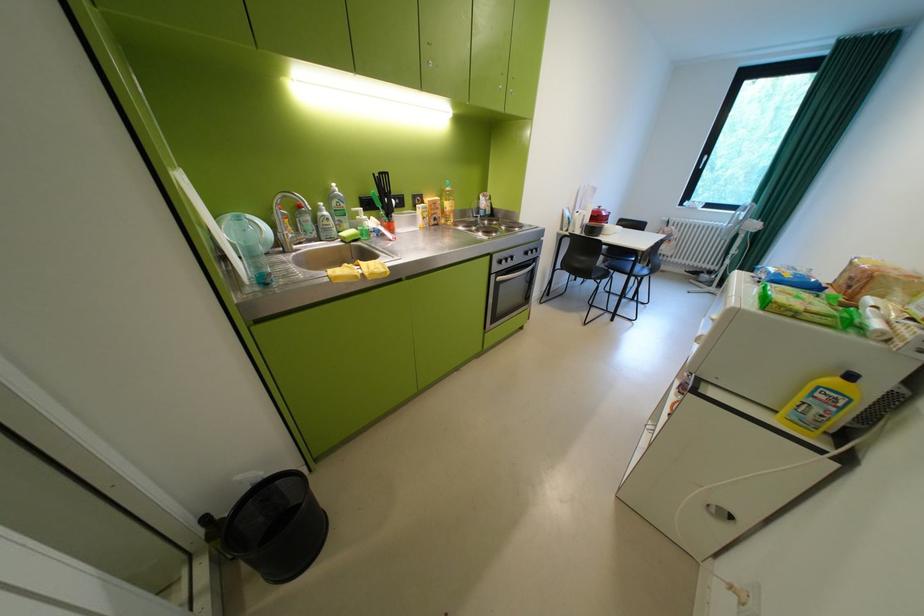
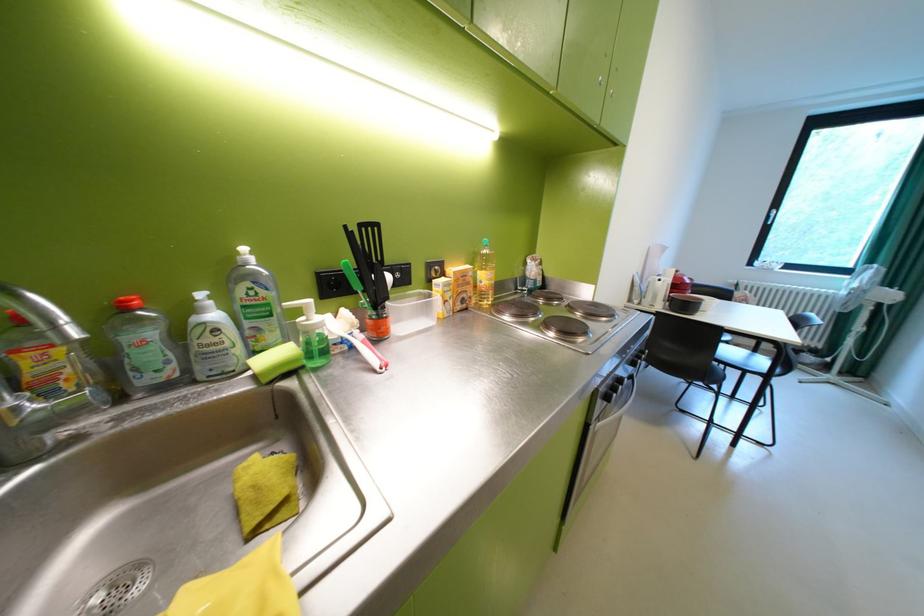
Question: How did the camera likely rotate?

Choices:
 (A) Left
 (B) Right
 (C) Up
 (D) Down

Answer: (C)